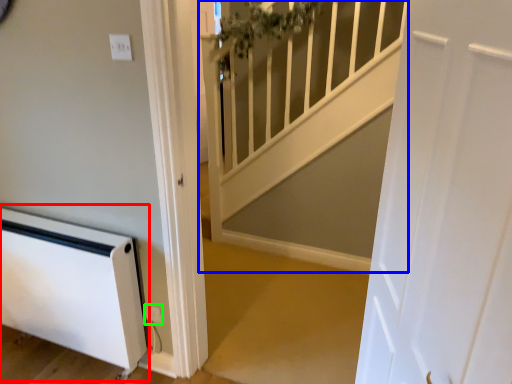
Question: Estimate the real-world distances between objects in this image. Which object is farther from appliance (highlighted by a red box), stairwell (highlighted by a blue box) or electric outlet (highlighted by a green box)?

Choices:
 (A) stairwell
 (B) electric outlet

Answer: (A)